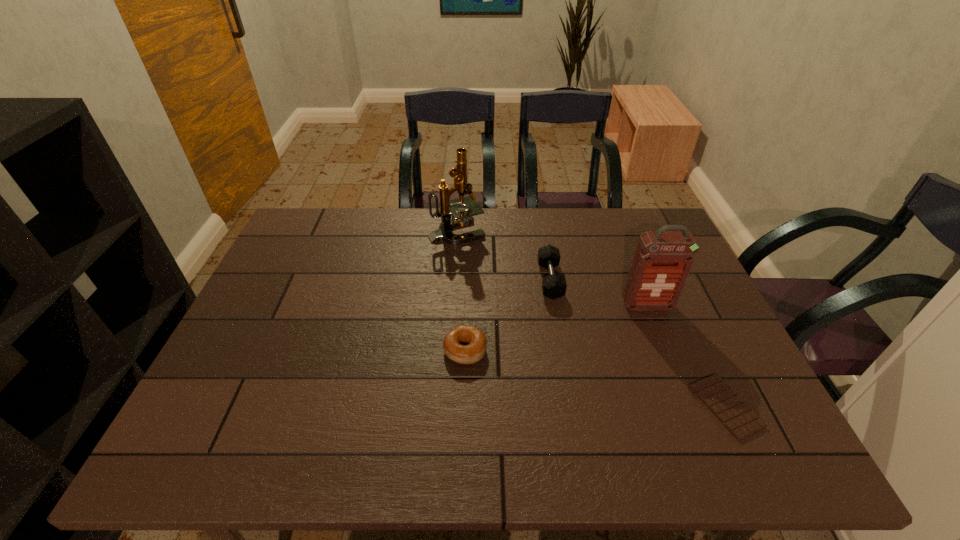
Where is `the farthest object`? This screenshot has height=540, width=960. the farthest object is located at coordinates (462, 217).

The image size is (960, 540). What are the coordinates of `the first-aid kit` in the screenshot? It's located at (663, 259).

Locate an element on the screen. dumbbell is located at coordinates click(x=554, y=286).

Where is `the third object from right to left`? The height and width of the screenshot is (540, 960). the third object from right to left is located at coordinates (554, 286).

This screenshot has width=960, height=540. In order to click on the fourth tallest object in this screenshot , I will do `click(474, 350)`.

Locate an element on the screen. The image size is (960, 540). bagel is located at coordinates (474, 350).

You are a GUI agent. You are given a task and a screenshot of the screen. Output one action in this format:
    pyautogui.click(x=<x>, y=<y>)
    Task: Click on the shortest object
    This screenshot has width=960, height=540.
    Given the screenshot: What is the action you would take?
    pyautogui.click(x=741, y=421)

Where is `chocolate bar`? This screenshot has height=540, width=960. chocolate bar is located at coordinates (741, 421).

Locate an element on the screen. vacant space situated 0.340m at the eyepiece of the microscope is located at coordinates (588, 231).

Locate an element on the screen. vacant space located 0.110m on the front-facing side of the first-aid kit is located at coordinates (662, 343).